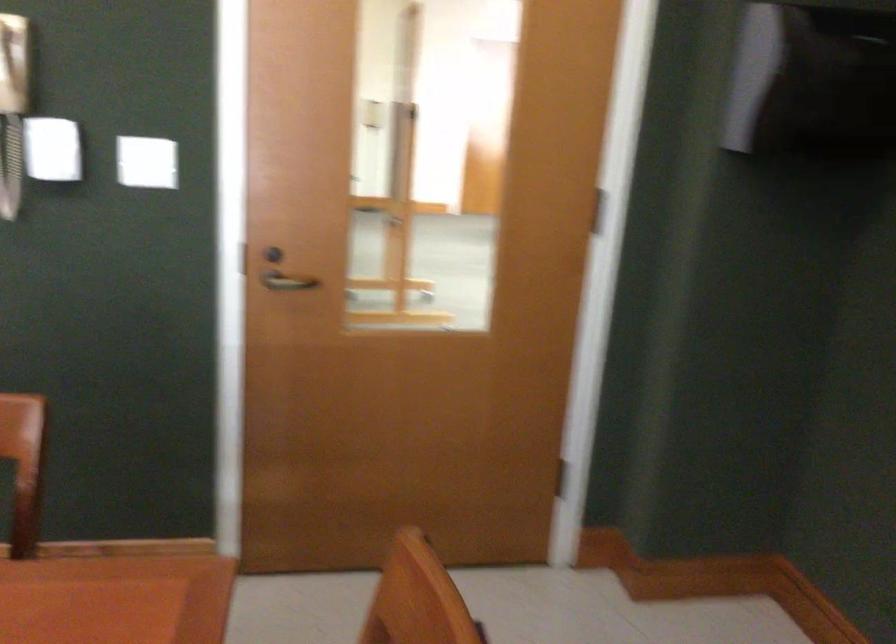
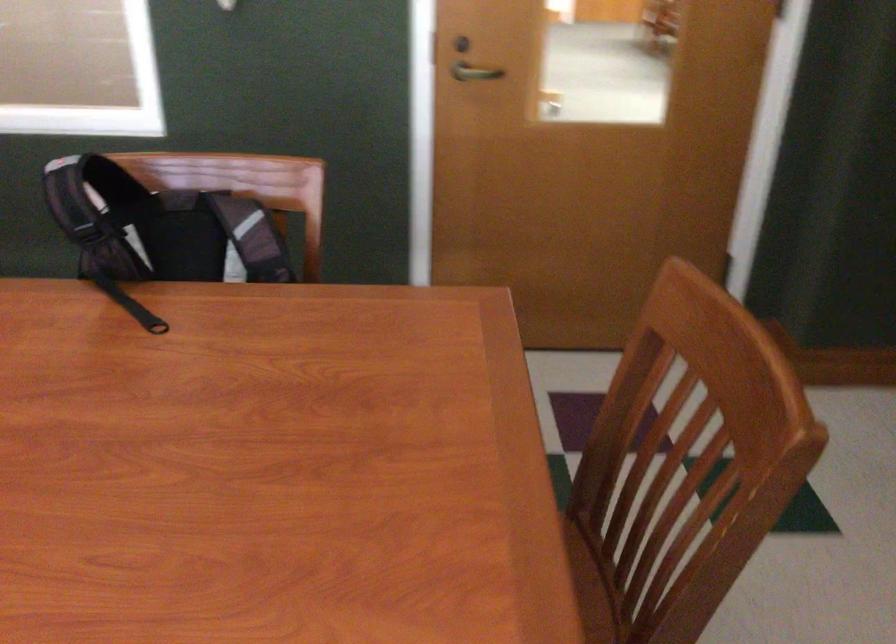
Find the pixel in the second image that matches point 260,251 in the first image.

(460, 44)